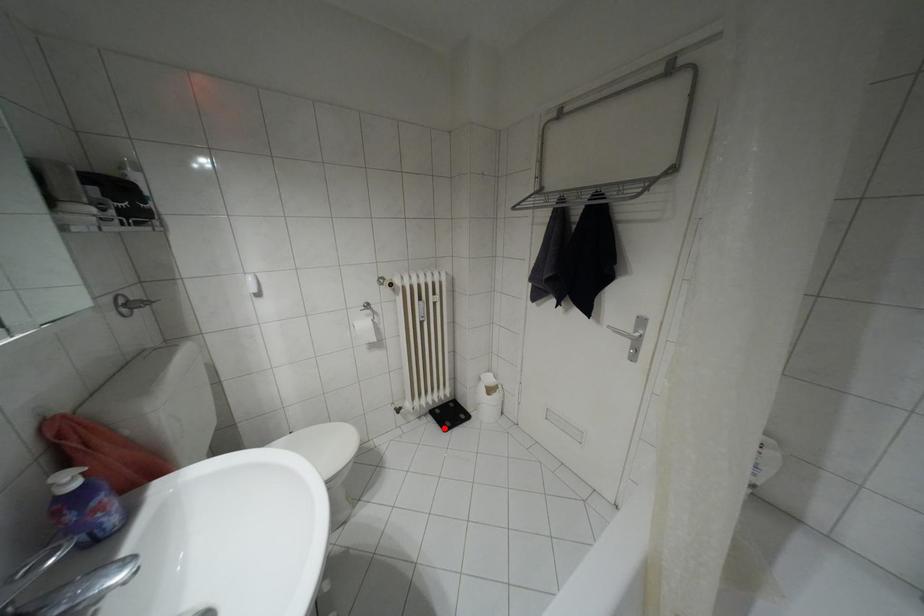
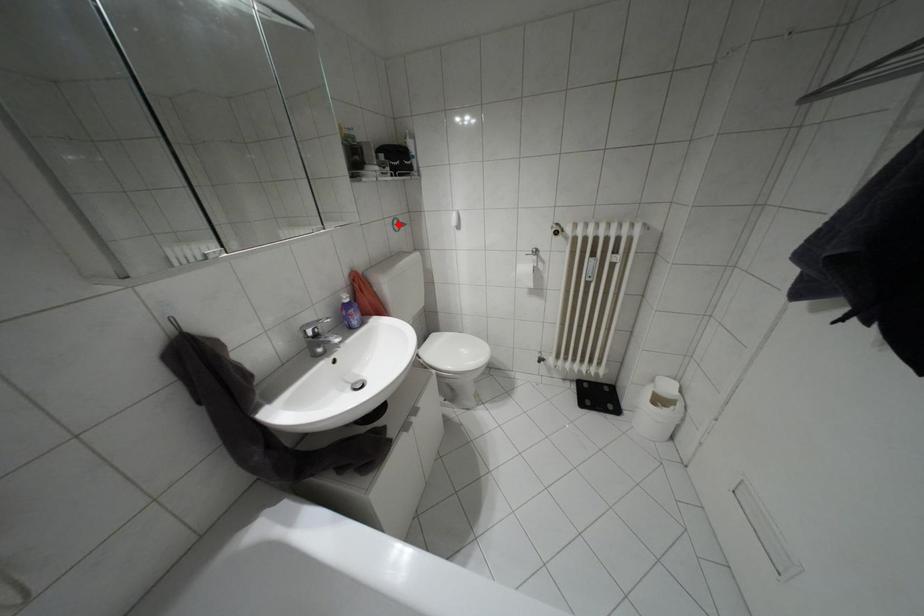
I am providing you with two images of the same scene from different viewpoints. A red point is marked on the first image and another point is marked on the second image. Are the points marked in image1 and image2 representing the same 3D position?

No